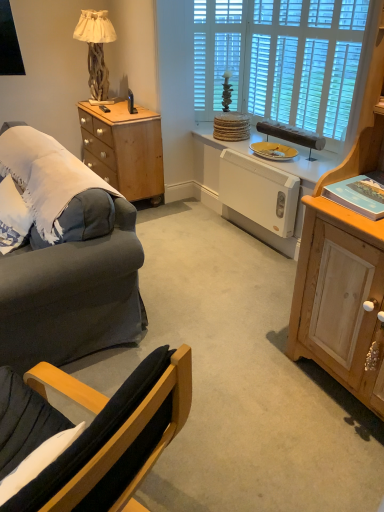
Question: Is point (89, 138) closer or farther from the camera than point (99, 105)?

Choices:
 (A) closer
 (B) farther

Answer: (B)

Question: Relative to black plastic remote control at upper left, is light wood/texture side table at left in front or behind?

Choices:
 (A) behind
 (B) front

Answer: (B)

Question: Which object is the farthest from the dark blue fabric chair at lower left?

Choices:
 (A) white wooden blinds at upper center
 (B) white textured glass door at upper center
 (C) light wood/texture side table at left
 (D) black plastic remote control at upper left
 (E) light wood cabinet at right

Answer: (B)

Question: Which object is the closest to the natural wood lamp at upper left?

Choices:
 (A) white wooden blinds at upper center
 (B) yellow matte plate at center
 (C) white textured glass door at upper center
 (D) black plastic remote control at upper left
 (E) dark blue fabric chair at lower left

Answer: (D)